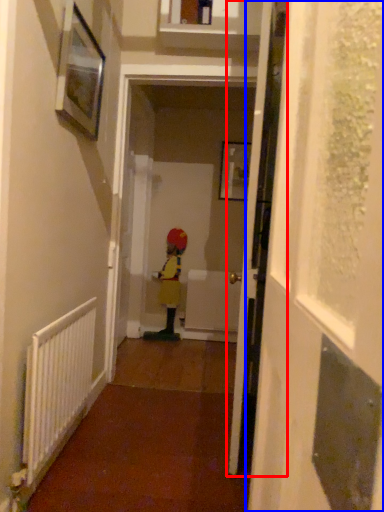
Question: Which of the following is the closest to the observer, door (highlighted by a red box) or screen door (highlighted by a blue box)?

Choices:
 (A) door
 (B) screen door

Answer: (B)